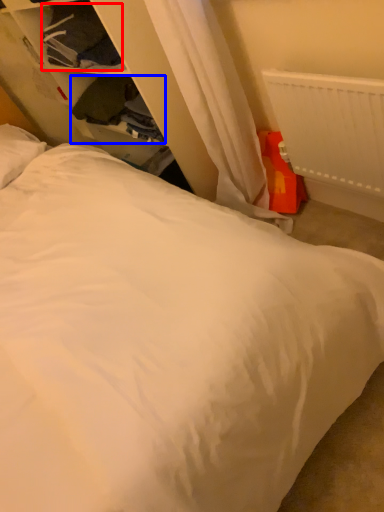
Question: Among these objects, which one is farthest to the camera, clothing (highlighted by a red box) or clothing (highlighted by a blue box)?

Choices:
 (A) clothing
 (B) clothing

Answer: (B)